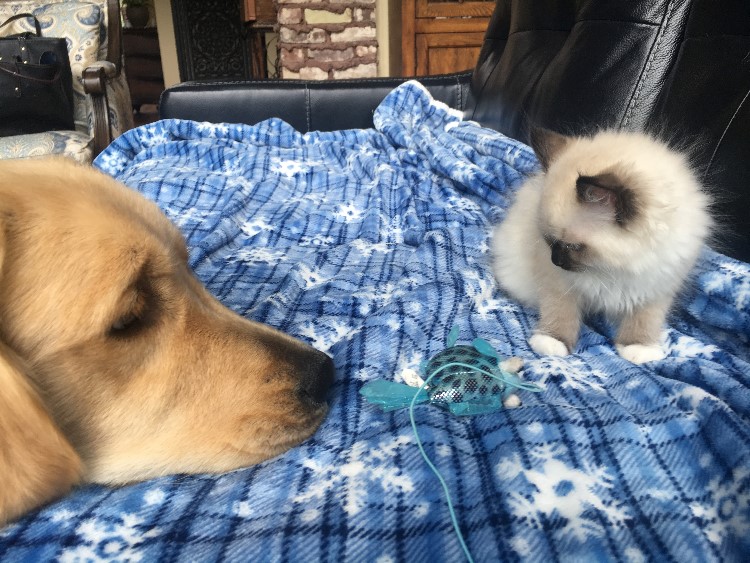
Locate an element on the screen. chair is located at coordinates (82, 38).